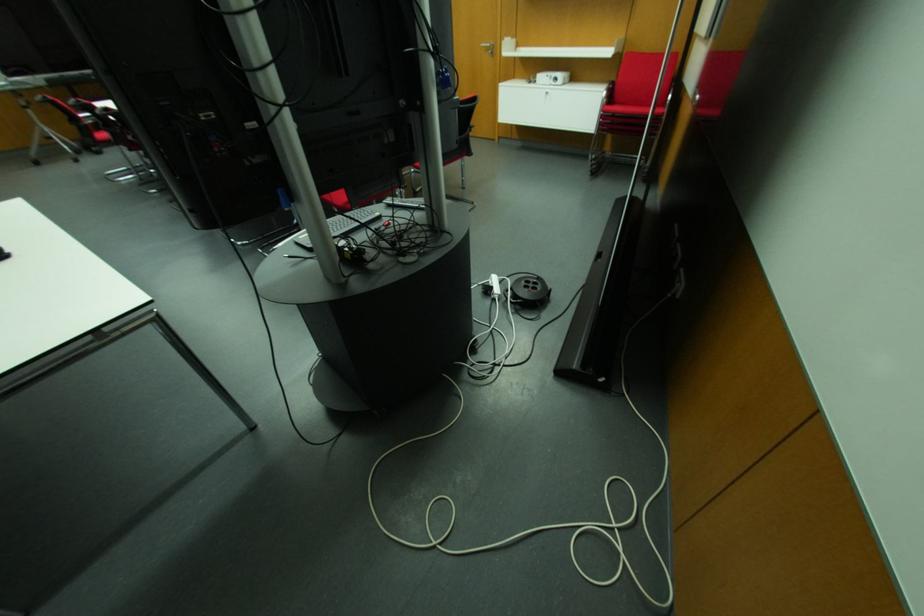
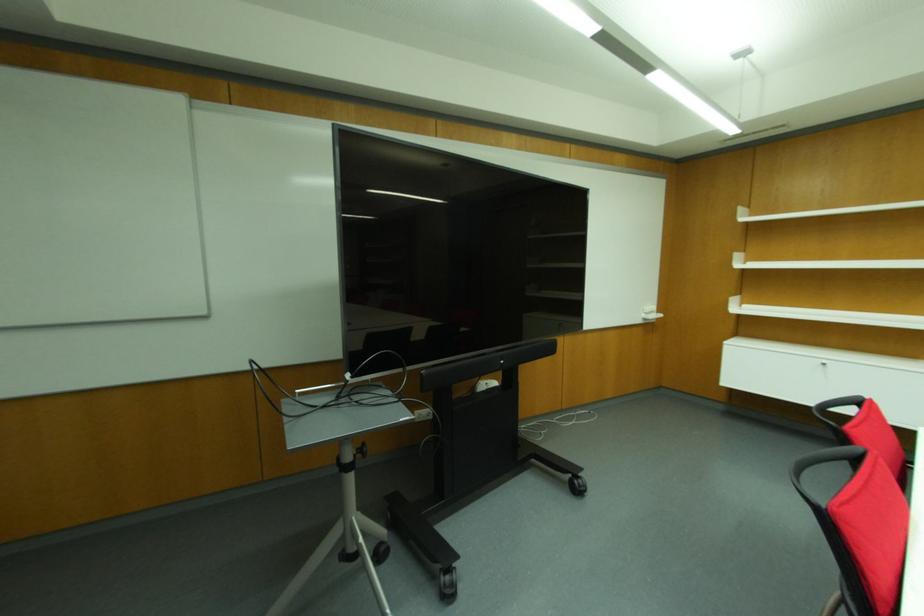
Locate, in the second image, the point that corresponds to [98,153] in the first image.

(448, 594)